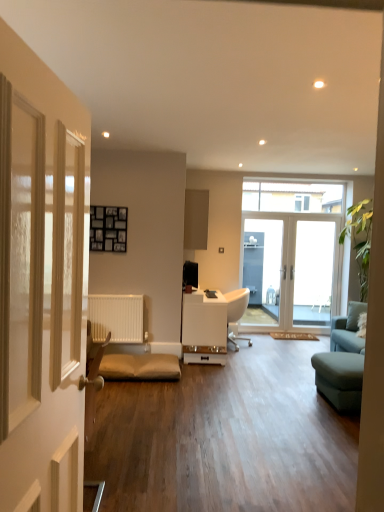
Question: Considering the positions of white glossy door at center, the second door from the front, and matte gray cabinet at upper center in the image, is white glossy door at center, the second door from the front, taller or shorter than matte gray cabinet at upper center?

Choices:
 (A) tall
 (B) short

Answer: (A)

Question: In the image, is white glossy door at center, the second door from the front, positioned in front of or behind matte gray cabinet at upper center?

Choices:
 (A) behind
 (B) front

Answer: (A)

Question: Which object is the farthest from the clear glass window at upper center?

Choices:
 (A) white glossy door at left, which is the second door in right-to-left order
 (B) transparent glass screen door at center
 (C) white glossy door at center, which is the 1th door in back-to-front order
 (D) matte gray cabinet at upper center
 (E) white glossy desk at center

Answer: (A)

Question: Estimate the real-world distances between objects in this image. Which object is farther from the white glossy door at center, the second door when ordered from left to right?

Choices:
 (A) transparent glass screen door at center
 (B) clear glass window at upper center
 (C) white glossy door at left, which is the second door in right-to-left order
 (D) matte gray cabinet at upper center
 (E) white glossy desk at center

Answer: (C)